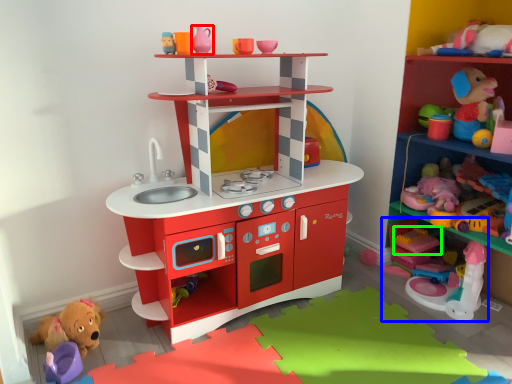
Question: Which object is the closest to the toy (highlighted by a red box)? Choose among these: toy (highlighted by a blue box) or toy (highlighted by a green box).

Choices:
 (A) toy
 (B) toy

Answer: (B)